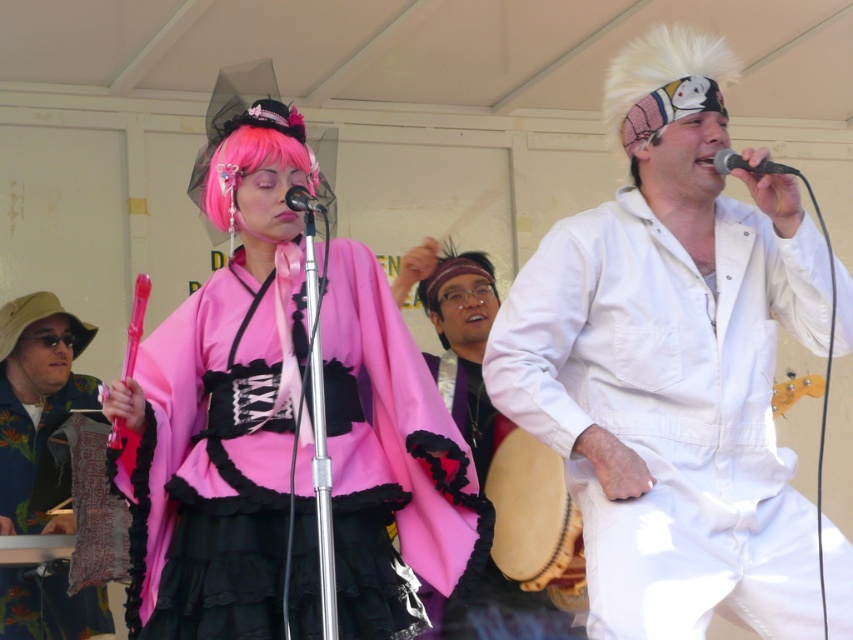
You are a stagehand setting up for a performance. You need to place a 1.5 meter long extension cord from the light brown wooden drum at lower center to the black metallic microphone at upper right. Will the cord be long enough to reach without needing to move either object?

The light brown wooden drum at lower center is 1.75 meters from the black metallic microphone at upper right. Since the extension cord is only 1.5 meters long, it will not be sufficient to reach between them without moving either object.

You are a photographer at the event and want to capture a closeup of the singer in the matte pink kimono at center without the black metallic microphone at upper right appearing in the frame. Based on their sizes, is this possible?

The matte pink kimono at center is wider than the black metallic microphone at upper right, so it is possible to frame the photo to focus solely on the singer in the matte pink kimono at center while excluding the microphone.

You are a stagehand who needs to move the light brown wooden drum at lower center to the left side of the stage. The performers are currently 5.49 meters away from the drum. Can you safely move the drum without disturbing the performers?

The performers are 5.49 meters away from the light brown wooden drum at lower center. Since the distance is relatively large, moving the drum carefully should be possible without disturbing them.